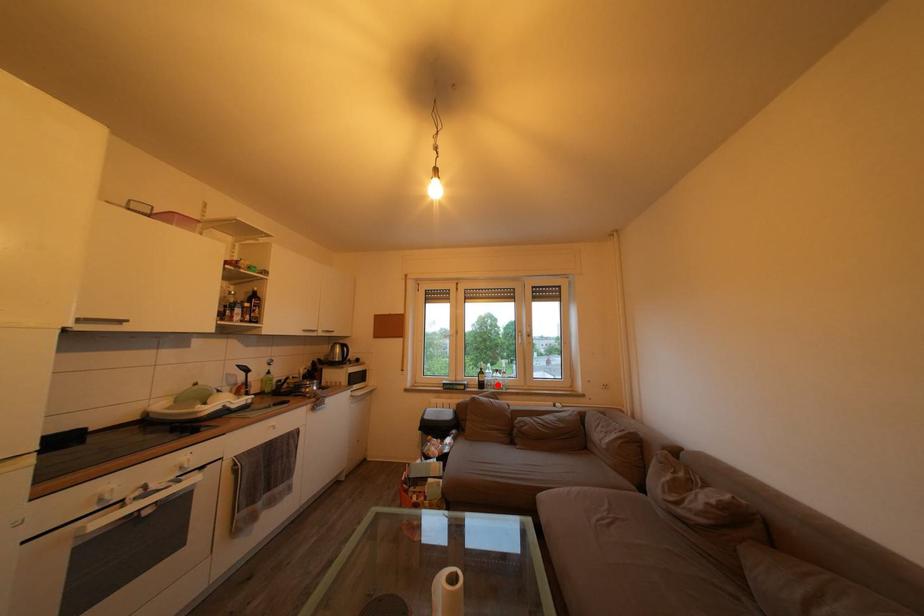
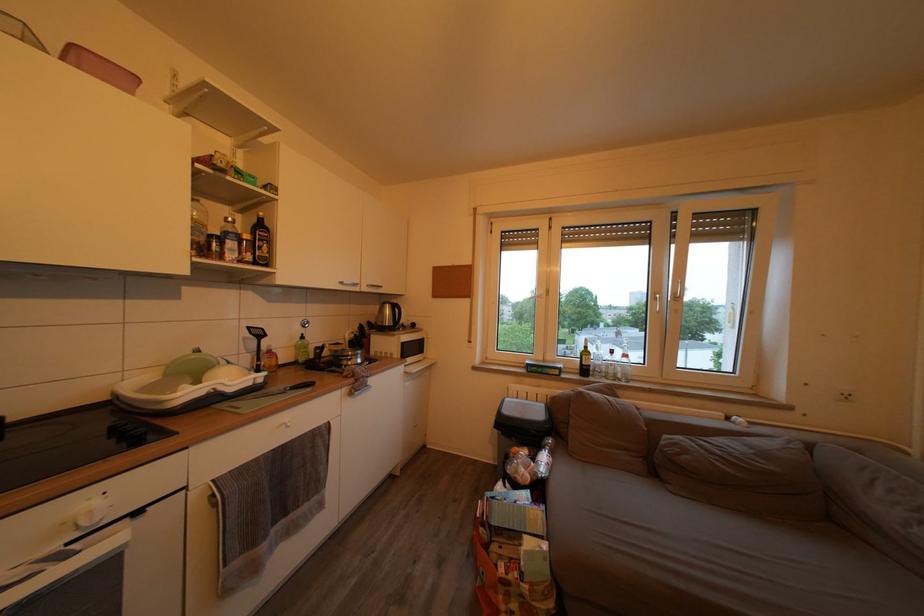
In the second image, find the point that corresponds to the highlighted location in the first image.

(608, 369)